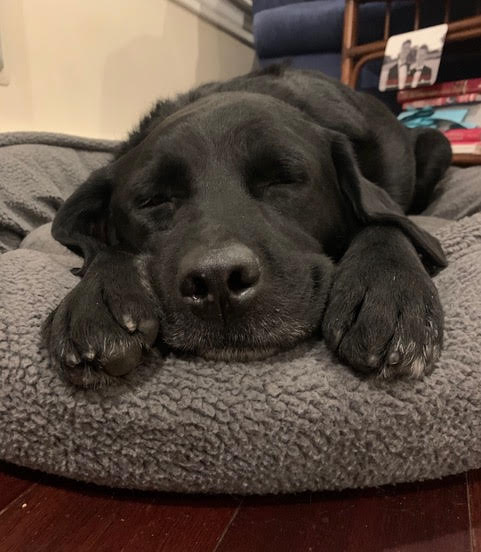
Find the location of `wall`. wall is located at coordinates tap(69, 79).